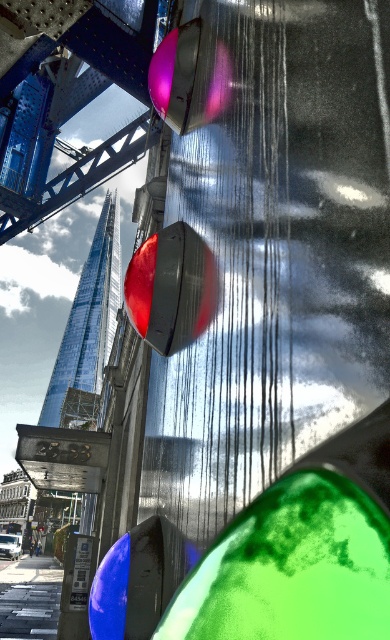
Question: Can you confirm if matte black traffic light at center is positioned to the right of matte black traffic light at upper center?

Choices:
 (A) no
 (B) yes

Answer: (A)

Question: Is matte black traffic light at center wider than matte black traffic light at upper center?

Choices:
 (A) no
 (B) yes

Answer: (B)

Question: Which of the following is the farthest from the observer?

Choices:
 (A) (159, 349)
 (B) (202, 115)

Answer: (A)

Question: Which point appears closest to the camera in this image?

Choices:
 (A) (187, 124)
 (B) (164, 314)

Answer: (B)

Question: Is matte black traffic light at center to the right of matte black traffic light at upper center from the viewer's perspective?

Choices:
 (A) no
 (B) yes

Answer: (A)